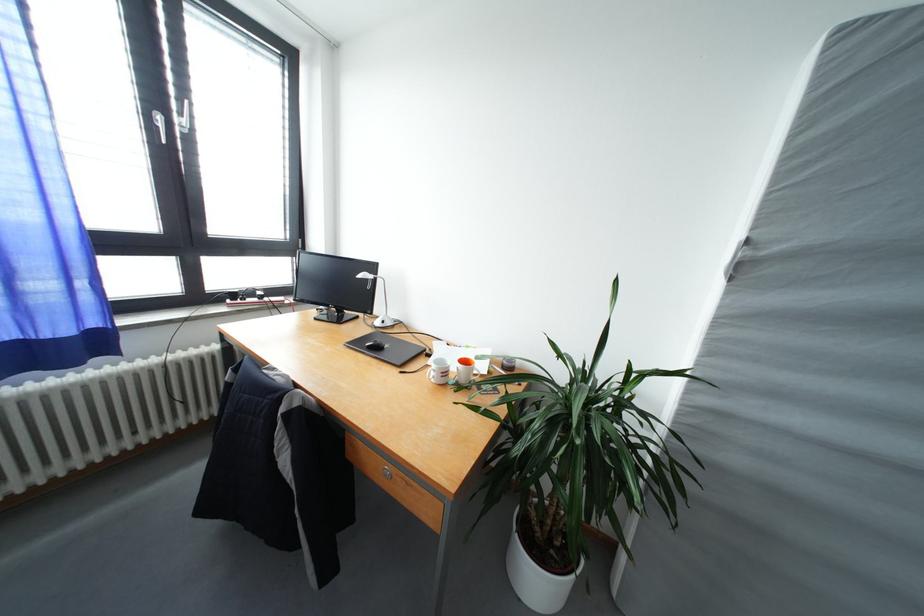
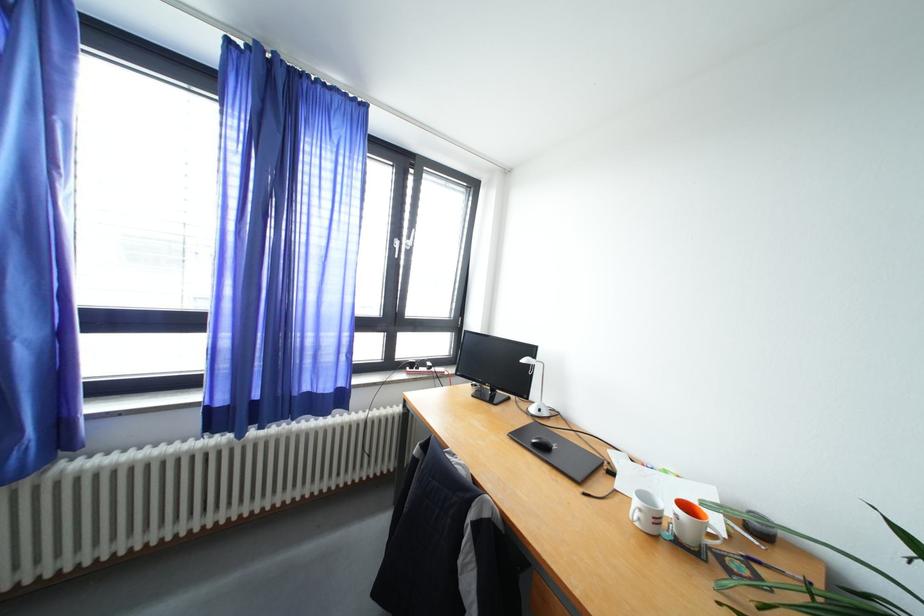
Question: Which direction would the cameraman need to move to produce the second image? Reply with the corresponding letter.

Choices:
 (A) Left
 (B) Right
 (C) Forward
 (D) Backward

Answer: (A)